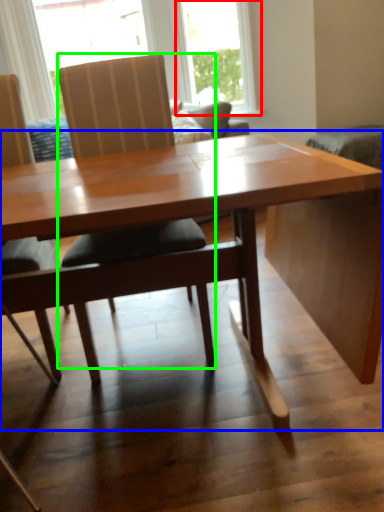
Question: Estimate the real-world distances between objects in this image. Which object is farther from window (highlighted by a red box), table (highlighted by a blue box) or chair (highlighted by a green box)?

Choices:
 (A) table
 (B) chair

Answer: (A)